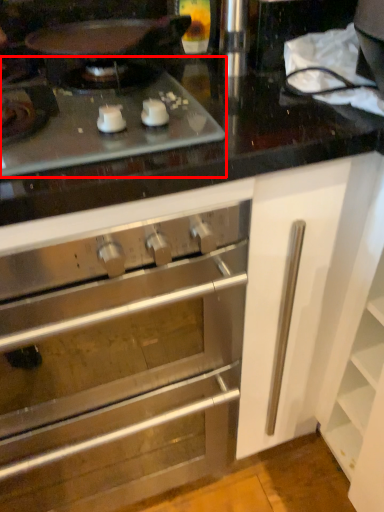
Question: From the image's perspective, considering the relative positions of gas stove (annotated by the red box) and cabinetry in the image provided, where is gas stove (annotated by the red box) located with respect to the staircase?

Choices:
 (A) below
 (B) above

Answer: (B)